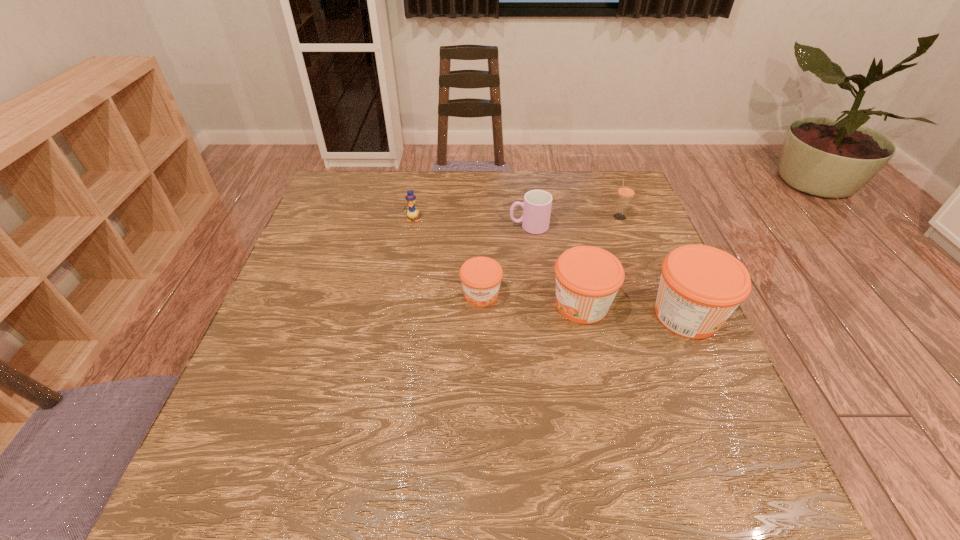
This screenshot has width=960, height=540. I want to click on vacant space that is in between the fifth object from right to left and the second jam from right to left, so click(x=531, y=300).

I want to click on empty space between the second tallest jam and the duckling, so click(497, 262).

The image size is (960, 540). What are the coordinates of `vacant area between the second jam from left to right and the shortest jam` in the screenshot? It's located at 531,300.

Where is `the closest object to the straw`? The height and width of the screenshot is (540, 960). the closest object to the straw is located at coordinates (537, 204).

The height and width of the screenshot is (540, 960). What are the coordinates of `object that is the fourth closest one to the duckling` in the screenshot? It's located at (626, 191).

Locate an element on the screen. The width and height of the screenshot is (960, 540). jam that is the second closest to the shortest jam is located at coordinates (700, 287).

Locate an element on the screen. jam that stands as the closest to the second jam from left to right is located at coordinates (700, 287).

Find the location of a particular element. Image resolution: width=960 pixels, height=540 pixels. free space that satisfies the following two spatial constraints: 1. on the face of the leftmost object, where the monocle is placed; 2. with the handle on the side of the cup is located at coordinates (411, 226).

Find the location of a particular element. vacant position in the image that satisfies the following two spatial constraints: 1. with the handle on the side of the cup; 2. on the face of the leftmost object, where the monocle is placed is located at coordinates (528, 219).